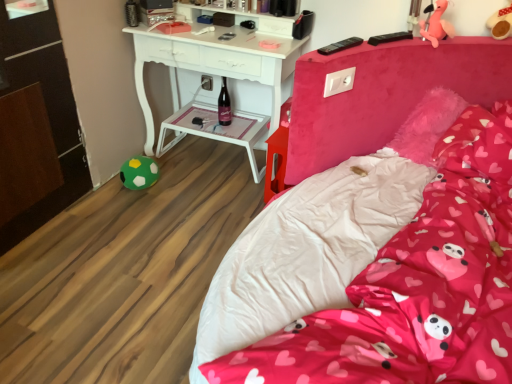
You are a GUI agent. You are given a task and a screenshot of the screen. Output one action in this format:
    pyautogui.click(x=<x>, y=<y>)
    Task: Click on the free location to the left of matte glass bottle at center
    This screenshot has height=384, width=512.
    Given the screenshot: What is the action you would take?
    pyautogui.click(x=199, y=123)